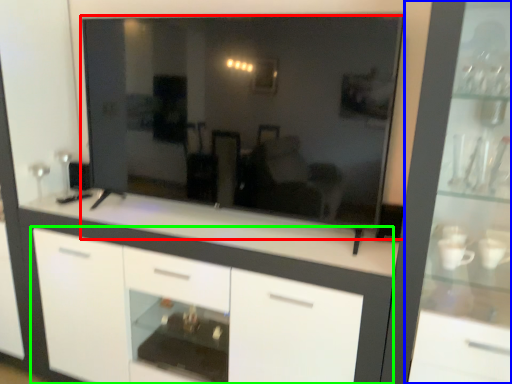
Question: Considering the real-world distances, which object is closest to mirror (highlighted by a red box)? dresser (highlighted by a blue box) or cabinetry (highlighted by a green box).

Choices:
 (A) dresser
 (B) cabinetry

Answer: (B)